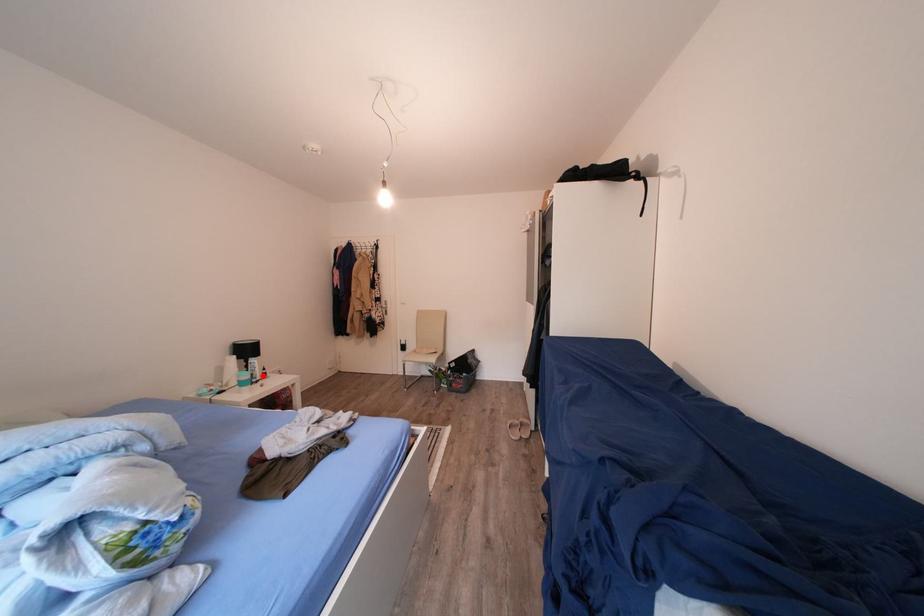
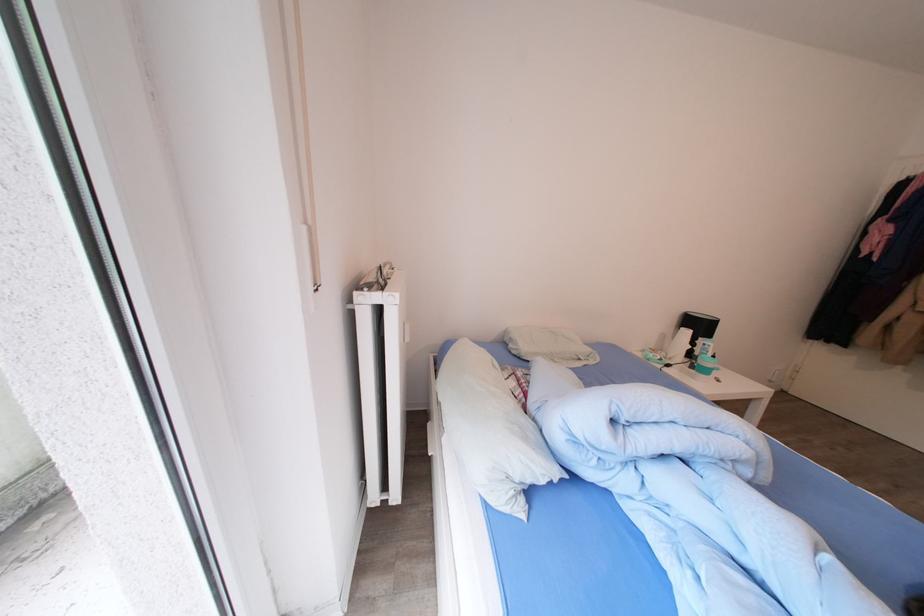
In the second image, find the point that corresponds to the highlighted location in the first image.

(712, 360)